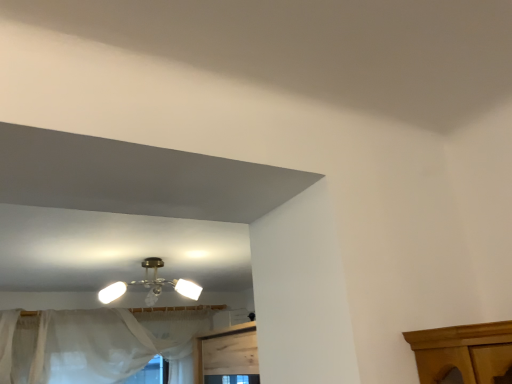
Locate an element on the screen. The height and width of the screenshot is (384, 512). sheer white curtain at lower left is located at coordinates (94, 344).

Image resolution: width=512 pixels, height=384 pixels. Describe the element at coordinates (94, 344) in the screenshot. I see `sheer white curtain at lower left` at that location.

What do you see at coordinates (151, 285) in the screenshot? I see `metallic brass chandelier at center` at bounding box center [151, 285].

Identify the location of metallic brass chandelier at center. click(x=151, y=285).

Identify the location of sheer white curtain at lower left. (94, 344).

Is sheer white curtain at lower left to the left of metallic brass chandelier at center from the viewer's perspective?

Yes, sheer white curtain at lower left is to the left of metallic brass chandelier at center.

Is sheer white curtain at lower left in front of metallic brass chandelier at center?

No.

Does point (78, 320) come closer to viewer compared to point (194, 294)?

That is False.

From the image's perspective, is sheer white curtain at lower left above or below metallic brass chandelier at center?

Clearly, from the image's perspective, sheer white curtain at lower left is below metallic brass chandelier at center.

From a real-world perspective, who is located lower, sheer white curtain at lower left or metallic brass chandelier at center?

From a 3D spatial view, sheer white curtain at lower left is below.

Which of these two, sheer white curtain at lower left or metallic brass chandelier at center, is thinner?

sheer white curtain at lower left is thinner.

Which of these two, sheer white curtain at lower left or metallic brass chandelier at center, stands taller?

sheer white curtain at lower left is taller.

Who is smaller, sheer white curtain at lower left or metallic brass chandelier at center?

metallic brass chandelier at center is smaller.

Is metallic brass chandelier at center located within sheer white curtain at lower left?

Definitely not — metallic brass chandelier at center is not inside sheer white curtain at lower left.

Does sheer white curtain at lower left touch metallic brass chandelier at center?

No, sheer white curtain at lower left is not beside metallic brass chandelier at center.

Is sheer white curtain at lower left facing towards metallic brass chandelier at center?

Yes, sheer white curtain at lower left is oriented towards metallic brass chandelier at center.

Measure the distance between sheer white curtain at lower left and metallic brass chandelier at center.

The distance of sheer white curtain at lower left from metallic brass chandelier at center is 77.90 centimeters.

I want to click on curtain lying on the left of metallic brass chandelier at center, so click(94, 344).

Which is more to the left, metallic brass chandelier at center or sheer white curtain at lower left?

sheer white curtain at lower left is more to the left.

Which object is closer to the camera, metallic brass chandelier at center or sheer white curtain at lower left?

metallic brass chandelier at center is closer to the camera.

Is point (186, 285) positioned before point (150, 326)?

Yes.

From the image's perspective, is metallic brass chandelier at center above sheer white curtain at lower left?

Yes, from the image's perspective, metallic brass chandelier at center is over sheer white curtain at lower left.

From a real-world perspective, between metallic brass chandelier at center and sheer white curtain at lower left, who is vertically lower?

From a 3D spatial view, sheer white curtain at lower left is below.

Is metallic brass chandelier at center wider than sheer white curtain at lower left?

Yes.

In terms of height, does metallic brass chandelier at center look taller or shorter compared to sheer white curtain at lower left?

metallic brass chandelier at center is shorter than sheer white curtain at lower left.

Can you confirm if metallic brass chandelier at center is bigger than sheer white curtain at lower left?

Actually, metallic brass chandelier at center might be smaller than sheer white curtain at lower left.

Can we say metallic brass chandelier at center lies outside sheer white curtain at lower left?

Absolutely, metallic brass chandelier at center is external to sheer white curtain at lower left.

Is metallic brass chandelier at center touching sheer white curtain at lower left?

metallic brass chandelier at center is not next to sheer white curtain at lower left, and they're not touching.

Does metallic brass chandelier at center turn towards sheer white curtain at lower left?

No, metallic brass chandelier at center does not turn towards sheer white curtain at lower left.

How far apart are metallic brass chandelier at center and sheer white curtain at lower left?

metallic brass chandelier at center is 30.67 inches from sheer white curtain at lower left.

Find the location of `curtain on the left of metallic brass chandelier at center`. curtain on the left of metallic brass chandelier at center is located at coordinates (94, 344).

This screenshot has height=384, width=512. I want to click on curtain behind the metallic brass chandelier at center, so click(94, 344).

Locate an element on the screen. The width and height of the screenshot is (512, 384). lamp above the sheer white curtain at lower left (from the image's perspective) is located at coordinates (151, 285).